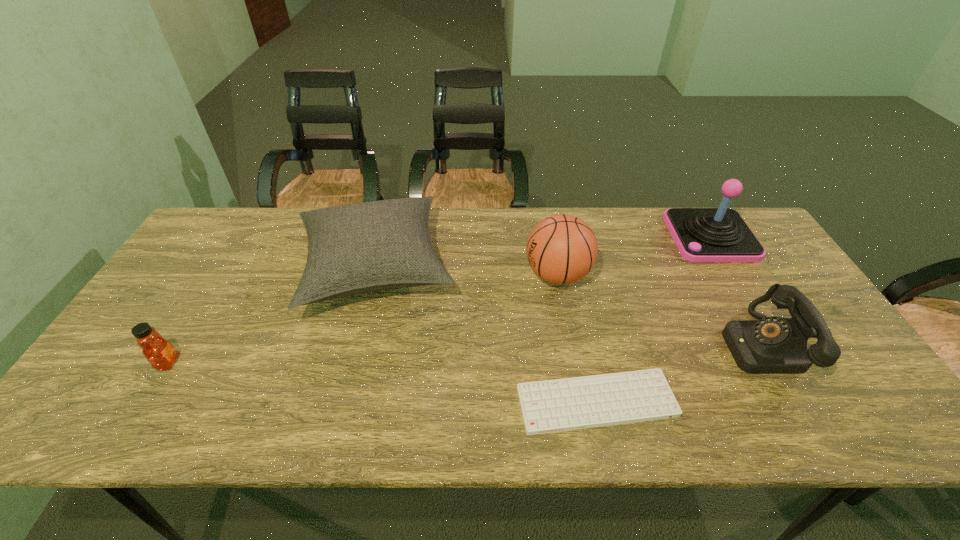
Locate an element on the screen. This screenshot has width=960, height=540. free space between the computer keyboard and the basketball is located at coordinates (577, 339).

This screenshot has width=960, height=540. I want to click on free space between the computer keyboard and the second shortest object, so click(382, 382).

At what (x,y) coordinates should I click in order to perform the action: click on free space that is in between the shortest object and the telephone. Please return your answer as a coordinate pair (x, y). The height and width of the screenshot is (540, 960). Looking at the image, I should click on (678, 373).

Find the location of a particular element. This screenshot has width=960, height=540. vacant space that's between the telephone and the fifth tallest object is located at coordinates (464, 353).

Where is `unoccupied area between the basketball and the telephone`? unoccupied area between the basketball and the telephone is located at coordinates pyautogui.click(x=659, y=309).

Where is `unoccupied position between the cushion and the telephone`? This screenshot has width=960, height=540. unoccupied position between the cushion and the telephone is located at coordinates (567, 306).

I want to click on vacant space in between the basketball and the joystick, so click(634, 256).

This screenshot has height=540, width=960. I want to click on free point between the shortest object and the telephone, so click(678, 373).

Find the location of a particular element. This screenshot has height=540, width=960. free space between the cushion and the telephone is located at coordinates (567, 306).

Select which object appears as the closest to the fifth object from right to left. Please provide its 2D coordinates. Your answer should be formatted as a tuple, i.e. [(x, y)], where the tuple contains the x and y coordinates of a point satisfying the conditions above.

[(160, 353)]